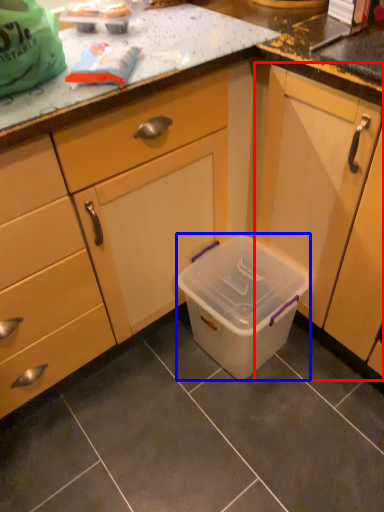
Question: Which object is closer to the camera taking this photo, cabinetry (highlighted by a red box) or storage box (highlighted by a blue box)?

Choices:
 (A) cabinetry
 (B) storage box

Answer: (A)